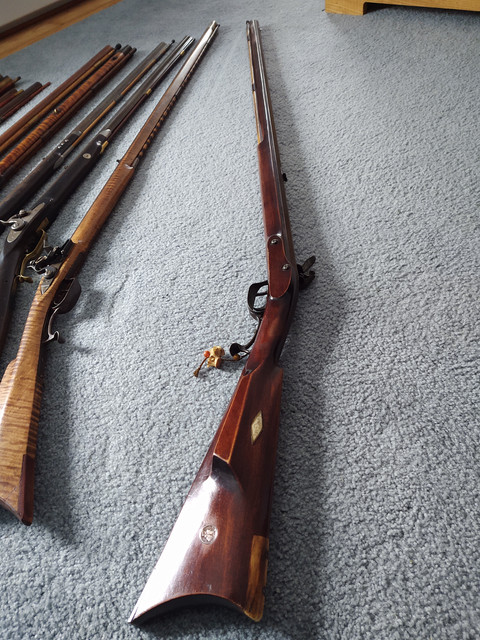
Locate an element on the screen. carpet is located at coordinates (407, 134).